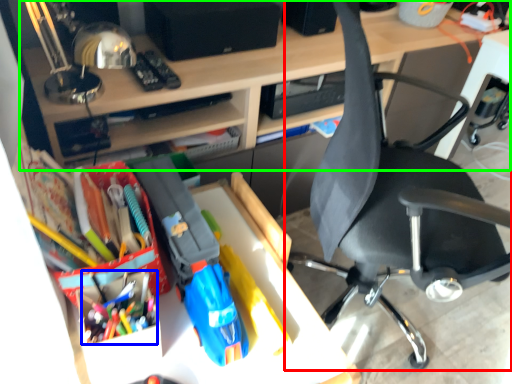
Question: Which object is the farthest from chair (highlighted by a red box)? Choose among these: stationery (highlighted by a blue box) or desk (highlighted by a green box).

Choices:
 (A) stationery
 (B) desk

Answer: (A)